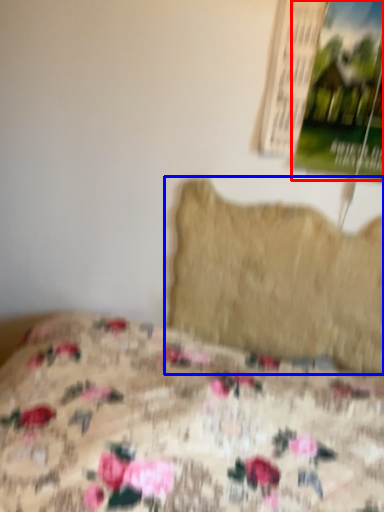
Question: Which object is closer to the camera taking this photo, poster page (highlighted by a red box) or pillow (highlighted by a blue box)?

Choices:
 (A) poster page
 (B) pillow

Answer: (A)